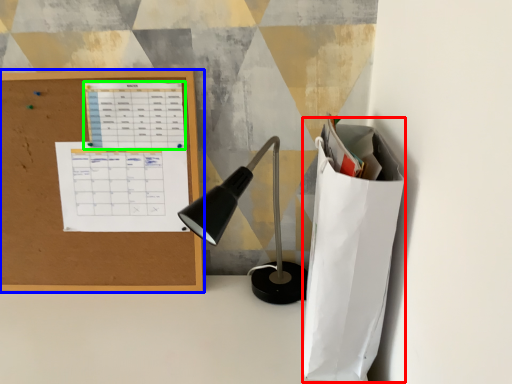
Question: Estimate the real-world distances between objects in this image. Which object is farther from paper bag (highlighted by a red box), office supplies (highlighted by a blue box) or notebook (highlighted by a green box)?

Choices:
 (A) office supplies
 (B) notebook

Answer: (A)